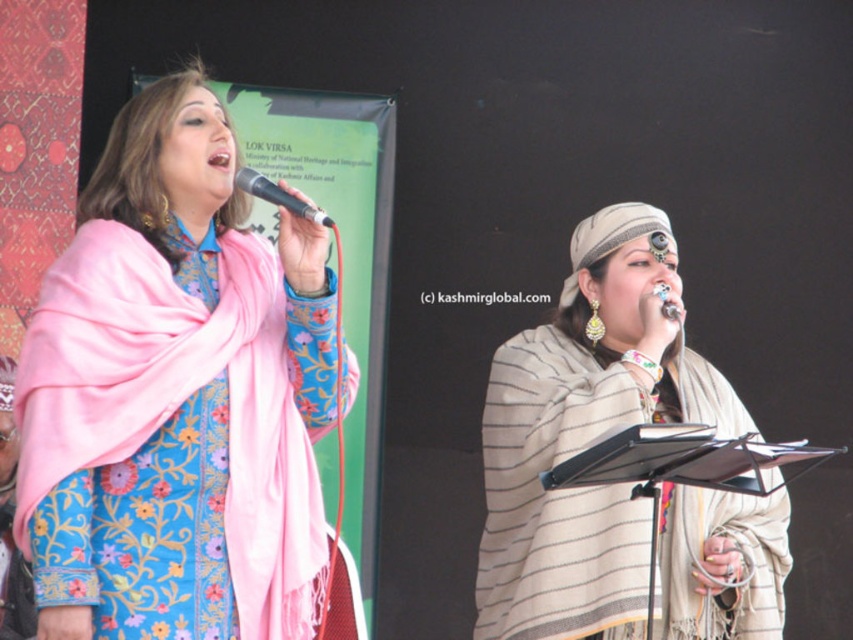
You are a photographer at the event and want to capture a closeup of the metallic silver microphone at upper center without the beige striped shawl at center being in the background. Is the microphone positioned far enough away from the shawl to achieve this?

The beige striped shawl at center is larger in size than the metallic silver microphone at upper center. Since the shawl is larger, it might still appear in the background even if the microphone is positioned away, so it might be challenging to capture the microphone without the shawl in the background.

You are a stagehand who needs to adjust the distance between the beige striped shawl at center and the metallic silver microphone at upper center to 3 meters for better visibility. Currently, they are 2.64 meters apart. How much more space in meters do you need to add between them?

The current distance between the beige striped shawl at center and the metallic silver microphone at upper center is 2.64 meters. To reach the desired 3 meters, you need to add 0.36 meters between them.